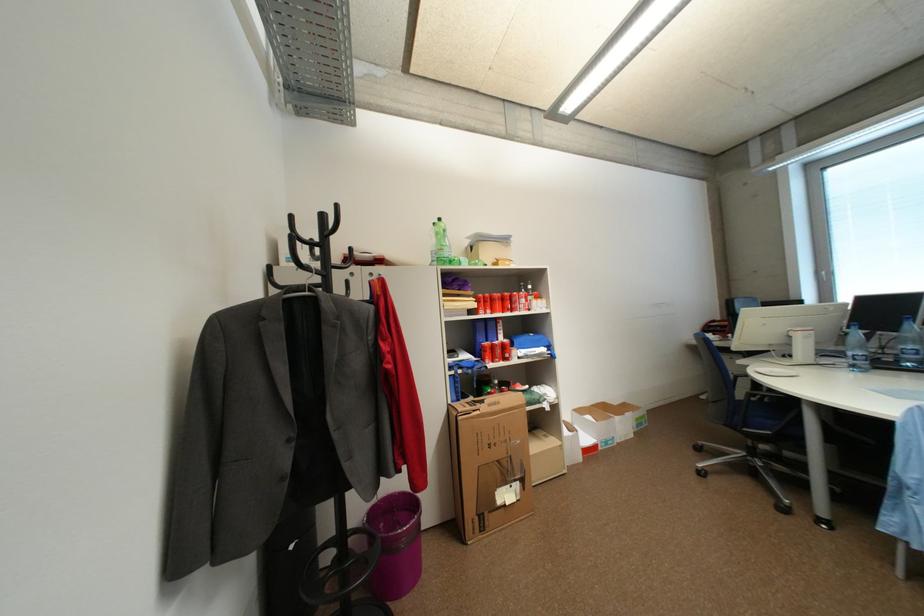
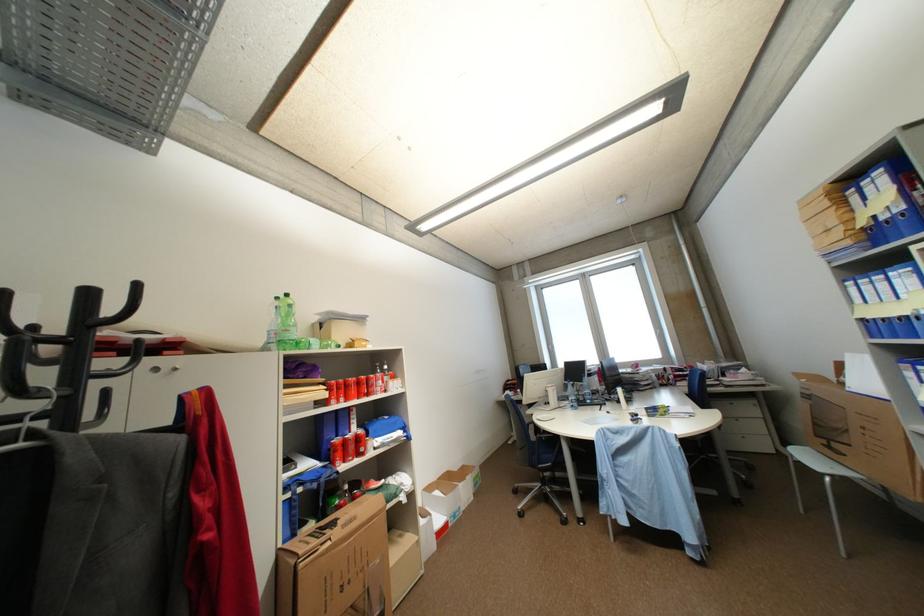
Question: How did the camera likely rotate?

Choices:
 (A) Left
 (B) Right
 (C) Up
 (D) Down

Answer: (B)